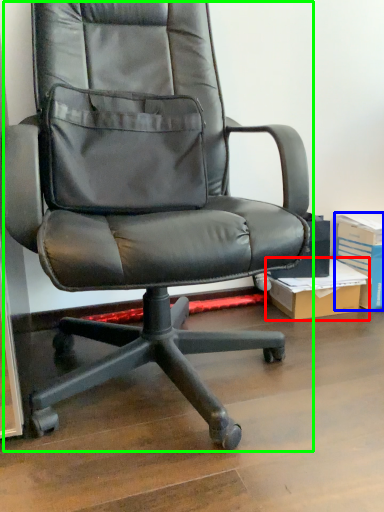
Question: Which is nearer to the cardboard box (highlighted by a red box)? paperback book (highlighted by a blue box) or chair (highlighted by a green box).

Choices:
 (A) paperback book
 (B) chair

Answer: (A)